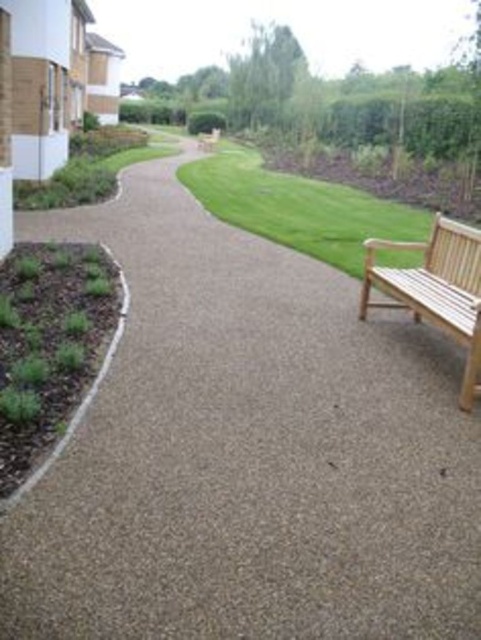
You are standing at the point marked by the coordinates point [298,208], which is on the green grass at center. Looking towards the building with a white wall and brick facade on the left side of the pathway, can you determine if the building is to your left or right?

The building with a white wall and brick facade is on the left side of the pathway. Since you are standing at point [298,208] on the green grass at center, the building would be to your left.

You are a gardener standing on the dark brown mulch at lower left. You want to walk to the green grass at center. Is there a clear path between them?

The dark brown mulch at lower left is in front of green grass at center, so there is a clear path between them.